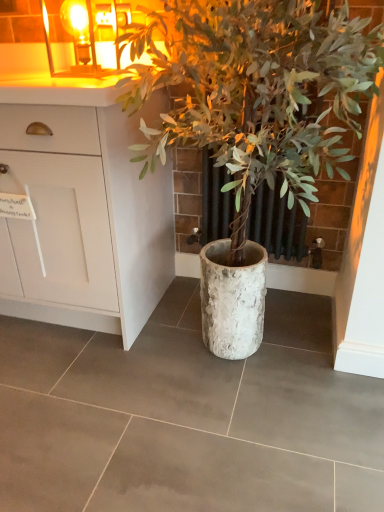
Question: Considering their positions, is amber glass candle at upper left located in front of or behind white matte cabinet at upper left?

Choices:
 (A) behind
 (B) front

Answer: (A)

Question: In terms of height, does amber glass candle at upper left look taller or shorter compared to white matte cabinet at upper left?

Choices:
 (A) tall
 (B) short

Answer: (B)

Question: Which object is positioned closest to the white textured pot at center?

Choices:
 (A) white matte cabinet at upper left
 (B) amber glass candle at upper left

Answer: (A)

Question: Which of these objects is positioned farthest from the white textured pot at center?

Choices:
 (A) amber glass candle at upper left
 (B) white matte cabinet at upper left

Answer: (A)